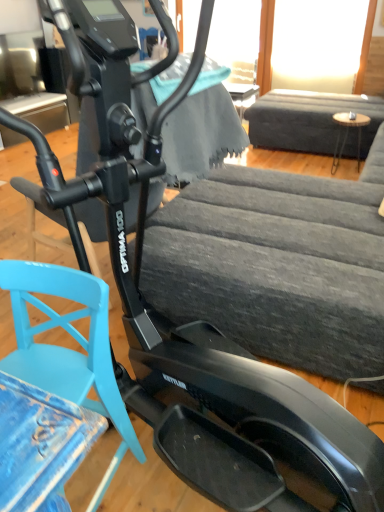
Question: From the image's perspective, is light blue plastic swivel chair at lower left above or below dark gray fabric couch at upper right?

Choices:
 (A) below
 (B) above

Answer: (A)

Question: Considering the relative positions of light blue plastic swivel chair at lower left and dark gray fabric couch at upper right in the image provided, is light blue plastic swivel chair at lower left to the left or to the right of dark gray fabric couch at upper right?

Choices:
 (A) left
 (B) right

Answer: (A)

Question: Estimate the real-world distances between objects in this image. Which object is farther from the light blue plastic swivel chair at lower left?

Choices:
 (A) dark gray fabric couch at upper right
 (B) wooden round table at right

Answer: (A)

Question: Which of these objects is positioned farthest from the light blue plastic swivel chair at lower left?

Choices:
 (A) wooden round table at right
 (B) dark gray fabric couch at upper right

Answer: (B)